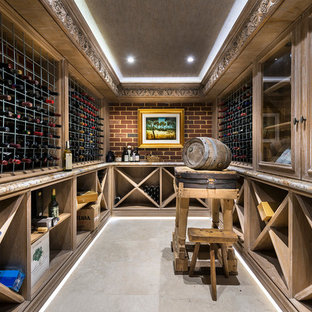
Where is `chair`? This screenshot has height=312, width=312. chair is located at coordinates (211, 238).